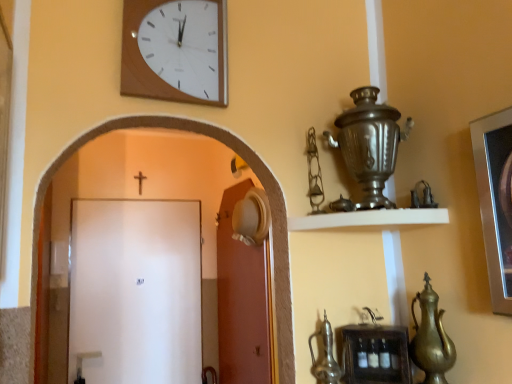
The image size is (512, 384). Identify the location of white matte shelf at upper center, the first shelf positioned from the top. (370, 219).

In terms of height, does wooden shelf at lower center, which is counted as the 1th shelf, starting from the bottom, look taller or shorter compared to metallic silver teapot at lower center, placed as the second tea pot when sorted from right to left?

In the image, wooden shelf at lower center, which is counted as the 1th shelf, starting from the bottom, appears to be shorter than metallic silver teapot at lower center, placed as the second tea pot when sorted from right to left.

Considering the sizes of objects wooden shelf at lower center, which is counted as the 1th shelf, starting from the bottom, and metallic silver teapot at lower center, placed as the 1th tea pot when sorted from left to right, in the image provided, who is thinner, wooden shelf at lower center, which is counted as the 1th shelf, starting from the bottom, or metallic silver teapot at lower center, placed as the 1th tea pot when sorted from left to right,?

With smaller width is metallic silver teapot at lower center, placed as the 1th tea pot when sorted from left to right.

How many degrees apart are the facing directions of wooden shelf at lower center, which is counted as the 1th shelf, starting from the bottom, and metallic silver teapot at lower center, placed as the second tea pot when sorted from right to left?

1.79 degrees.

Does wooden shelf at lower center, the 2th shelf from the top, turn towards metallic silver teapot at lower center, placed as the second tea pot when sorted from right to left?

Yes.

Can you confirm if wooden shelf at lower center, the 2th shelf from the top, is wider than shiny silver samovar at upper right?

No.

From the image's perspective, is wooden shelf at lower center, which is counted as the 1th shelf, starting from the bottom, above shiny silver samovar at upper right?

No, from the image's perspective, wooden shelf at lower center, which is counted as the 1th shelf, starting from the bottom, is not over shiny silver samovar at upper right.

Considering the positions of objects wooden shelf at lower center, which is counted as the 1th shelf, starting from the bottom, and shiny silver samovar at upper right in the image provided, who is behind, wooden shelf at lower center, which is counted as the 1th shelf, starting from the bottom, or shiny silver samovar at upper right?

Positioned behind is wooden shelf at lower center, which is counted as the 1th shelf, starting from the bottom.

In the scene shown: Which is closer, (x=407, y=347) or (x=356, y=126)?

Point (x=407, y=347)

Who is more distant, gold metallic teapot at lower right, which appears as the second tea pot when viewed from the left, or metallic silver teapot at lower center, placed as the second tea pot when sorted from right to left?

metallic silver teapot at lower center, placed as the second tea pot when sorted from right to left.

From the image's perspective, which one is positioned lower, gold metallic teapot at lower right, marked as the first tea pot in a right-to-left arrangement, or metallic silver teapot at lower center, placed as the second tea pot when sorted from right to left?

metallic silver teapot at lower center, placed as the second tea pot when sorted from right to left, appears lower in the image.

Is gold metallic teapot at lower right, marked as the first tea pot in a right-to-left arrangement, wider than metallic silver teapot at lower center, placed as the 1th tea pot when sorted from left to right?

Yes, gold metallic teapot at lower right, marked as the first tea pot in a right-to-left arrangement, is wider than metallic silver teapot at lower center, placed as the 1th tea pot when sorted from left to right.

Considering the positions of objects gold metallic teapot at lower right, marked as the first tea pot in a right-to-left arrangement, and metallic silver teapot at lower center, placed as the second tea pot when sorted from right to left, in the image provided, who is more to the right, gold metallic teapot at lower right, marked as the first tea pot in a right-to-left arrangement, or metallic silver teapot at lower center, placed as the second tea pot when sorted from right to left,?

Positioned to the right is gold metallic teapot at lower right, marked as the first tea pot in a right-to-left arrangement.

Are white matte shelf at upper center, arranged as the second shelf when ordered from the bottom, and shiny silver samovar at upper right located far from each other?

No, there isn't a large distance between white matte shelf at upper center, arranged as the second shelf when ordered from the bottom, and shiny silver samovar at upper right.

From a real-world perspective, is white matte shelf at upper center, the first shelf positioned from the top, physically below shiny silver samovar at upper right?

Yes.

Is white matte shelf at upper center, arranged as the second shelf when ordered from the bottom, behind shiny silver samovar at upper right?

That is False.

Considering the relative sizes of white matte shelf at upper center, the first shelf positioned from the top, and shiny silver samovar at upper right in the image provided, is white matte shelf at upper center, the first shelf positioned from the top, taller than shiny silver samovar at upper right?

In fact, white matte shelf at upper center, the first shelf positioned from the top, may be shorter than shiny silver samovar at upper right.

Is gold metallic teapot at lower right, which appears as the second tea pot when viewed from the left, bigger than white matte shelf at upper center, arranged as the second shelf when ordered from the bottom?

No.

Which is farther, (435, 309) or (410, 214)?

The point (410, 214) is farther.

From a real-world perspective, is gold metallic teapot at lower right, which appears as the second tea pot when viewed from the left, located beneath white matte shelf at upper center, the first shelf positioned from the top?

Yes, from a real-world perspective, gold metallic teapot at lower right, which appears as the second tea pot when viewed from the left, is beneath white matte shelf at upper center, the first shelf positioned from the top.

Visually, is gold metallic teapot at lower right, which appears as the second tea pot when viewed from the left, positioned to the left or to the right of white matte shelf at upper center, the first shelf positioned from the top?

Clearly, gold metallic teapot at lower right, which appears as the second tea pot when viewed from the left, is on the right of white matte shelf at upper center, the first shelf positioned from the top, in the image.

Is gold metallic teapot at lower right, which appears as the second tea pot when viewed from the left, further to camera compared to white matte door at center, which ranks as the second door in right-to-left order?

No.

Which tea pot is the 2nd one when counting from the right side of the white matte door at center, which ranks as the second door in right-to-left order? Please provide its 2D coordinates.

[(431, 338)]

Which of these two, gold metallic teapot at lower right, marked as the first tea pot in a right-to-left arrangement, or white matte door at center, the 1th door positioned from the left, is bigger?

Bigger between the two is white matte door at center, the 1th door positioned from the left.

From the picture: Can you confirm if gold metallic teapot at lower right, marked as the first tea pot in a right-to-left arrangement, is thinner than white matte door at center, the 1th door positioned from the left?

No.

Are white matte shelf at upper center, the first shelf positioned from the top, and white matte door at center, the 1th door positioned from the left, making contact?

No, white matte shelf at upper center, the first shelf positioned from the top, is not making contact with white matte door at center, the 1th door positioned from the left.

Does white matte shelf at upper center, arranged as the second shelf when ordered from the bottom, lie in front of white matte door at center, which ranks as the second door in right-to-left order?

Yes.

Who is shorter, white matte shelf at upper center, arranged as the second shelf when ordered from the bottom, or white matte door at center, which ranks as the second door in right-to-left order?

With less height is white matte shelf at upper center, arranged as the second shelf when ordered from the bottom.

Is white matte shelf at upper center, the first shelf positioned from the top, bigger than white matte door at center, which ranks as the second door in right-to-left order?

Incorrect, white matte shelf at upper center, the first shelf positioned from the top, is not larger than white matte door at center, which ranks as the second door in right-to-left order.

The width and height of the screenshot is (512, 384). I want to click on shelf below the metallic silver teapot at lower center, placed as the second tea pot when sorted from right to left (from a real-world perspective), so click(x=375, y=354).

From the image's perspective, starting from the shiny silver samovar at upper right, which shelf is the 2nd one below? Please provide its 2D coordinates.

[(375, 354)]

Based on the photo, when comparing their distances from white matte shelf at upper center, arranged as the second shelf when ordered from the bottom, does white matte door at center, acting as the 1th door starting from the right, or white matte door at center, the 1th door positioned from the left, seem further?

white matte door at center, the 1th door positioned from the left, lies further to white matte shelf at upper center, arranged as the second shelf when ordered from the bottom, than the other object.

When comparing their distances from woodenclock at upper center, does gold metallic teapot at lower right, marked as the first tea pot in a right-to-left arrangement, or shiny silver samovar at upper right seem closer?

Based on the image, shiny silver samovar at upper right appears to be nearer to woodenclock at upper center.

Looking at the image, which one is located closer to black wooden crucifix at upper center, woodenclock at upper center or shiny silver samovar at upper right?

woodenclock at upper center is closer to black wooden crucifix at upper center.

When comparing their distances from metallic silver teapot at lower center, placed as the second tea pot when sorted from right to left, does white matte shelf at upper center, arranged as the second shelf when ordered from the bottom, or black wooden crucifix at upper center seem further?

black wooden crucifix at upper center.

Based on their spatial positions, is metallic silver teapot at lower center, placed as the second tea pot when sorted from right to left, or shiny silver samovar at upper right closer to woodenclock at upper center?

shiny silver samovar at upper right lies closer to woodenclock at upper center than the other object.

Looking at the image, which one is located closer to white matte door at center, the 1th door positioned from the left, woodenclock at upper center or wooden shelf at lower center, which is counted as the 1th shelf, starting from the bottom?

woodenclock at upper center lies closer to white matte door at center, the 1th door positioned from the left, than the other object.

Which object lies further to the anchor point black wooden crucifix at upper center, white matte door at center, which ranks as the second door in right-to-left order, or woodenclock at upper center?

The object further to black wooden crucifix at upper center is woodenclock at upper center.

When comparing their distances from wooden shelf at lower center, which is counted as the 1th shelf, starting from the bottom, does woodenclock at upper center or white matte door at center, which is the second door from left to right, seem further?

The object further to wooden shelf at lower center, which is counted as the 1th shelf, starting from the bottom, is white matte door at center, which is the second door from left to right.

The image size is (512, 384). What are the coordinates of `candle holder located between white matte shelf at upper center, the first shelf positioned from the top, and white matte door at center, acting as the 1th door starting from the right, in the depth direction` in the screenshot? It's located at (369, 145).

Locate an element on the screen. Image resolution: width=512 pixels, height=384 pixels. candle holder between gold metallic teapot at lower right, marked as the first tea pot in a right-to-left arrangement, and white matte door at center, the 1th door positioned from the left, in the front-back direction is located at coordinates (369, 145).

This screenshot has width=512, height=384. In order to click on door located between white matte shelf at upper center, the first shelf positioned from the top, and white matte door at center, which ranks as the second door in right-to-left order, in the depth direction in this screenshot , I will do `click(241, 301)`.

Where is `tea pot between shiny silver samovar at upper right and white matte door at center, acting as the 1th door starting from the right, in the front-back direction`? tea pot between shiny silver samovar at upper right and white matte door at center, acting as the 1th door starting from the right, in the front-back direction is located at coordinates (325, 356).